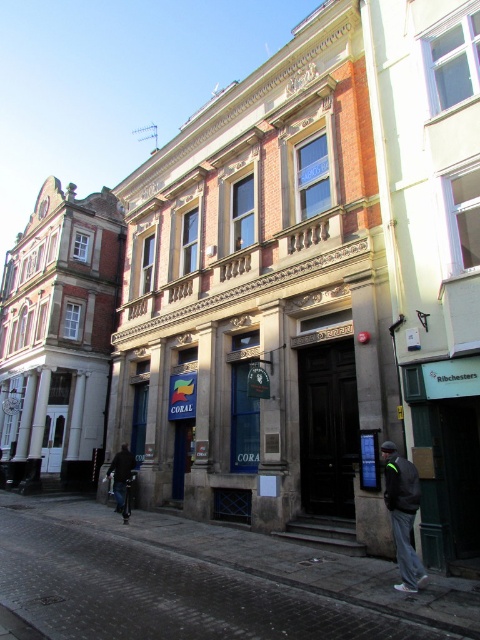
Between dark gray jacket at lower right and dark blue jeans at lower left, which one is positioned higher?

dark gray jacket at lower right

Who is lower down, dark gray jacket at lower right or dark blue jeans at lower left?

dark blue jeans at lower left is lower down.

The height and width of the screenshot is (640, 480). I want to click on dark gray jacket at lower right, so click(x=403, y=513).

You are a GUI agent. You are given a task and a screenshot of the screen. Output one action in this format:
    pyautogui.click(x=<x>, y=<y>)
    Task: Click on the dark gray jacket at lower right
    This screenshot has width=480, height=640.
    Given the screenshot: What is the action you would take?
    pyautogui.click(x=403, y=513)